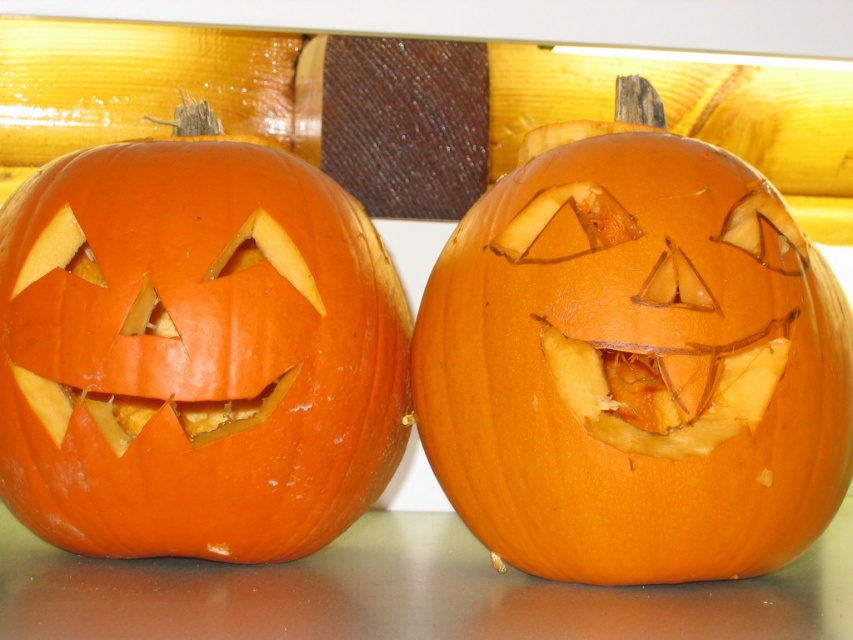
Question: Which object appears closest to the camera in this image?

Choices:
 (A) orange matte pumpkin at left
 (B) orange carved pumpkin at center

Answer: (B)

Question: Among these points, which one is farthest from the camera?

Choices:
 (A) (403, 352)
 (B) (465, 460)

Answer: (A)

Question: Is orange carved pumpkin at center to the right of orange matte pumpkin at left from the viewer's perspective?

Choices:
 (A) no
 (B) yes

Answer: (B)

Question: Can you confirm if orange carved pumpkin at center is positioned above orange matte pumpkin at left?

Choices:
 (A) no
 (B) yes

Answer: (B)

Question: Does orange carved pumpkin at center have a lesser width compared to orange matte pumpkin at left?

Choices:
 (A) yes
 (B) no

Answer: (B)